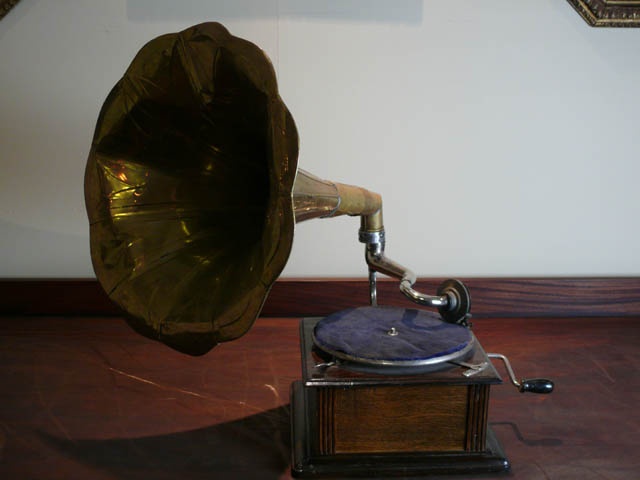
This screenshot has height=480, width=640. Identify the location of wood floor. (66, 372), (208, 365), (139, 412), (580, 326), (585, 411), (534, 348).